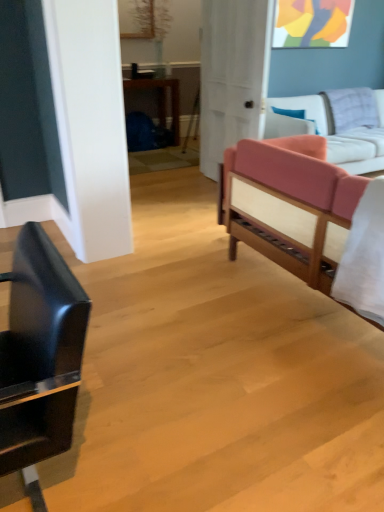
Find the location of `vacant area that lies to the right of shiny black chair at left`. vacant area that lies to the right of shiny black chair at left is located at coordinates (150, 457).